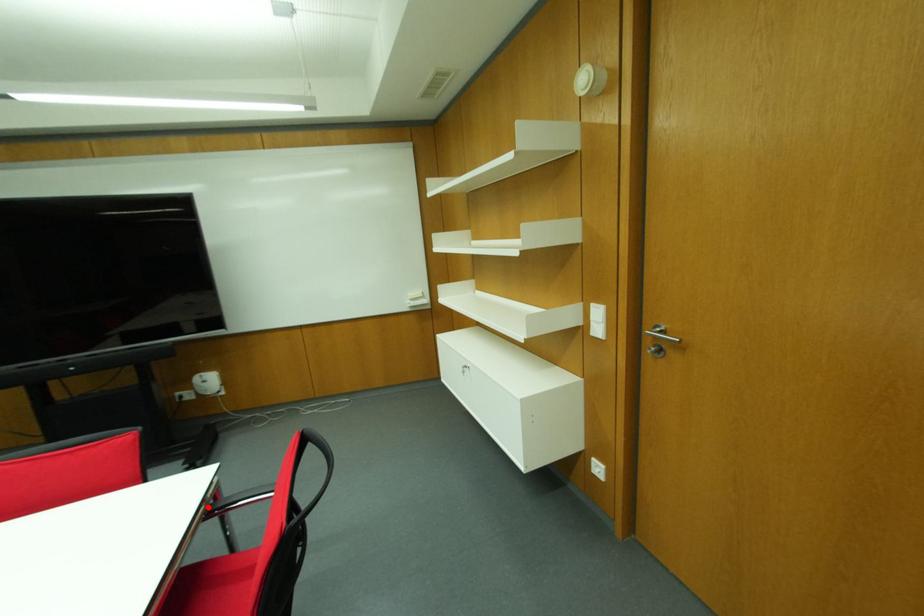
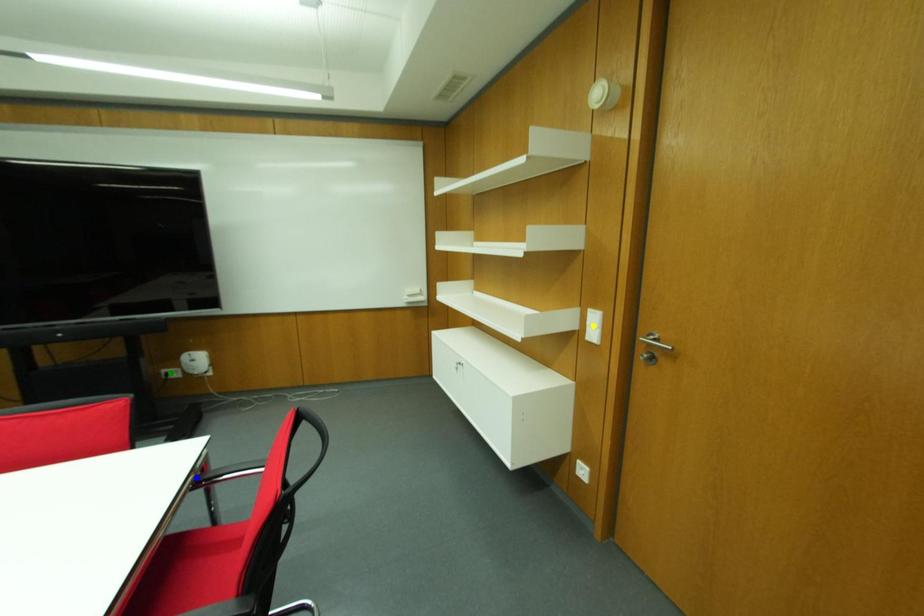
Question: I am providing you with two images of the same scene from different viewpoints. A red point is marked on the first image. You are given multiple points on the second image. Which mark in image 2 goes with the point in image 1?

Choices:
 (A) green point
 (B) yellow point
 (C) blue point

Answer: (C)